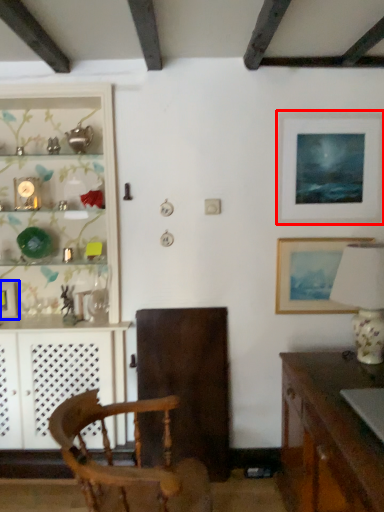
Question: Which object is further to the camera taking this photo, picture frame (highlighted by a red box) or picture frame (highlighted by a blue box)?

Choices:
 (A) picture frame
 (B) picture frame

Answer: (B)